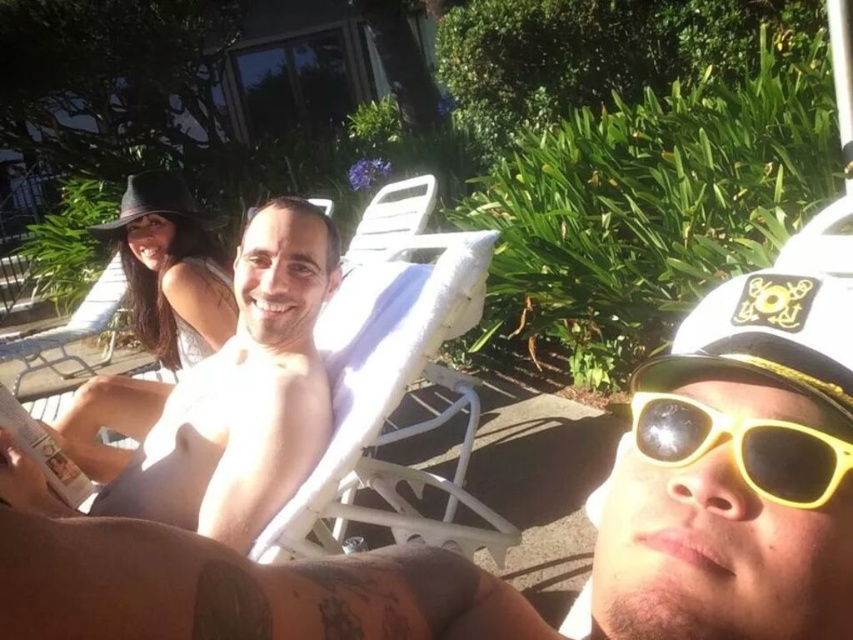
You are a photographer trying to capture both the smooth skin man at center and the white plastic beach chair at upper left in the same frame. Based on their sizes in the image, which object would you need to focus on first if you want to ensure both are in focus?

The smooth skin man at center is smaller than the white plastic beach chair at upper left, so you should focus on the white plastic beach chair at upper left first to ensure both are in focus since it is larger and closer to the camera.

You are a photographer trying to capture a group photo of the smooth skin man at center and the white plastic beach chair at upper left. If you want to ensure both subjects are fully visible in the frame, which one should you position closer to the camera?

The smooth skin man at center has a lesser width compared to the white plastic beach chair at upper left, so you should position the smooth skin man at center closer to the camera to ensure both are fully visible.

You are standing at the center of the poolside area and want to pick up the yellow plastic sunglasses at lower right. Which direction should you move to reach them?

The yellow plastic sunglasses at lower right are located at point 0.700 on the x axis and 0.871 on the y axis. Since you are at the center, you should move towards the lower right direction to reach them.